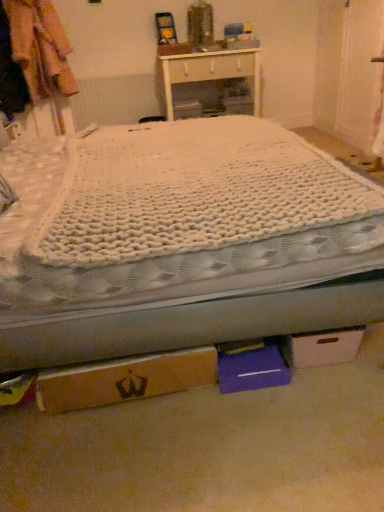
Question: From the image's perspective, is white glossy cabinet at upper center above white knitted mattress at center?

Choices:
 (A) yes
 (B) no

Answer: (A)

Question: Is white glossy cabinet at upper center shorter than white knitted mattress at center?

Choices:
 (A) yes
 (B) no

Answer: (B)

Question: From the image's perspective, is white glossy cabinet at upper center below white knitted mattress at center?

Choices:
 (A) no
 (B) yes

Answer: (A)

Question: Considering the relative sizes of white glossy cabinet at upper center and white knitted mattress at center in the image provided, is white glossy cabinet at upper center smaller than white knitted mattress at center?

Choices:
 (A) no
 (B) yes

Answer: (A)

Question: Is white glossy cabinet at upper center taller than white knitted mattress at center?

Choices:
 (A) no
 (B) yes

Answer: (B)

Question: Is white glossy cabinet at upper center in front of white knitted mattress at center?

Choices:
 (A) no
 (B) yes

Answer: (A)

Question: Does white knitted blanket at center turn towards white glossy cabinet at upper center?

Choices:
 (A) no
 (B) yes

Answer: (A)

Question: From the image's perspective, is white knitted blanket at center on white glossy cabinet at upper center?

Choices:
 (A) no
 (B) yes

Answer: (A)

Question: Can you confirm if white knitted blanket at center is shorter than white glossy cabinet at upper center?

Choices:
 (A) yes
 (B) no

Answer: (A)

Question: Is white knitted blanket at center with white glossy cabinet at upper center?

Choices:
 (A) no
 (B) yes

Answer: (A)

Question: Is white glossy cabinet at upper center surrounded by white knitted blanket at center?

Choices:
 (A) no
 (B) yes

Answer: (A)

Question: Can we say white knitted blanket at center lies outside white glossy cabinet at upper center?

Choices:
 (A) yes
 (B) no

Answer: (A)

Question: Is brown cardboard box at lower center, the second cardboard box positioned from the right, bigger than white knitted blanket at center?

Choices:
 (A) no
 (B) yes

Answer: (A)